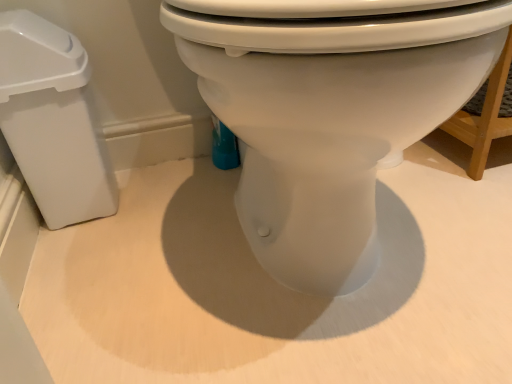
Question: Should I look upward or downward to see white glossy toilet at center?

Choices:
 (A) down
 (B) up

Answer: (B)